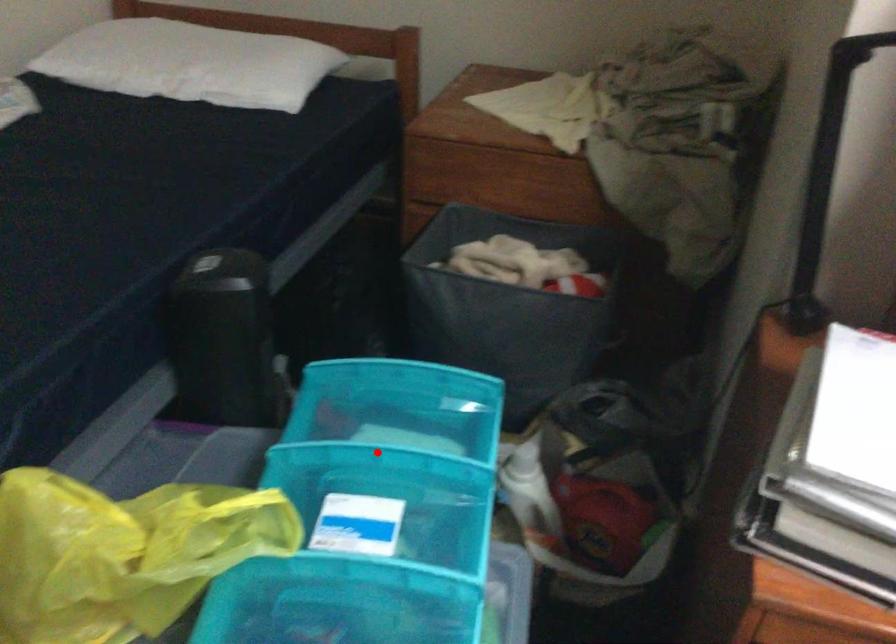
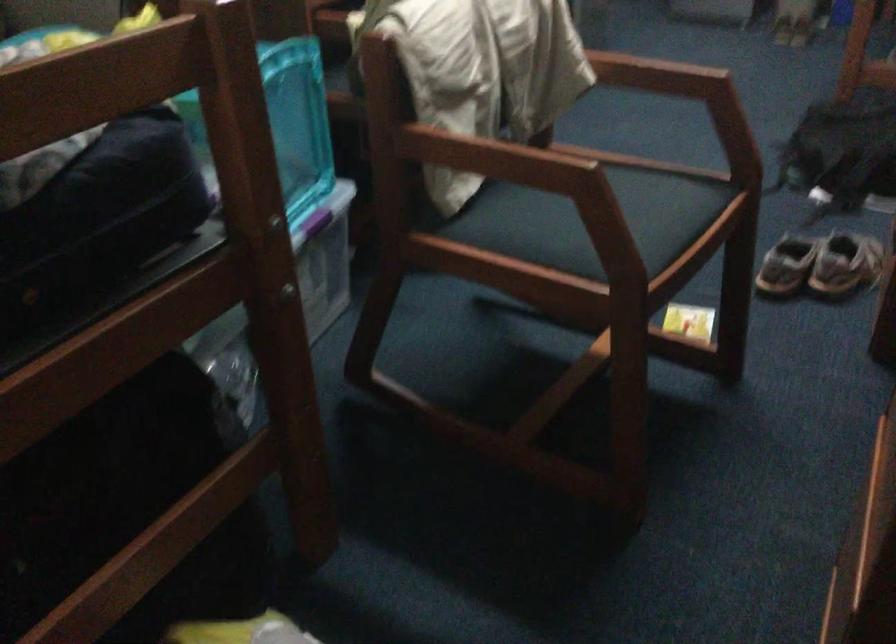
Question: I am providing you with two images of the same scene from different viewpoints. A red point is marked on the first image. At the location where the point appears in image 1, is it still visible in image 2?

Choices:
 (A) Yes
 (B) No

Answer: (B)